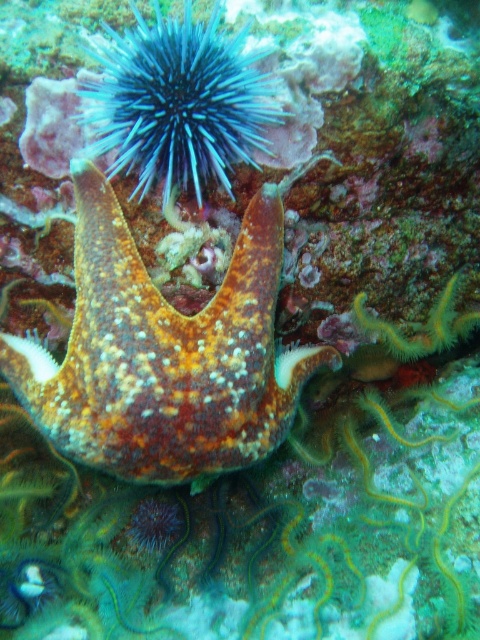
Can you confirm if rusty textured starfish at center is positioned to the right of blue spiny sea urchin at upper center?

Correct, you'll find rusty textured starfish at center to the right of blue spiny sea urchin at upper center.

Between point (229, 403) and point (200, 163), which one is positioned behind?

The point (200, 163) is more distant.

The height and width of the screenshot is (640, 480). Identify the location of rusty textured starfish at center. (166, 353).